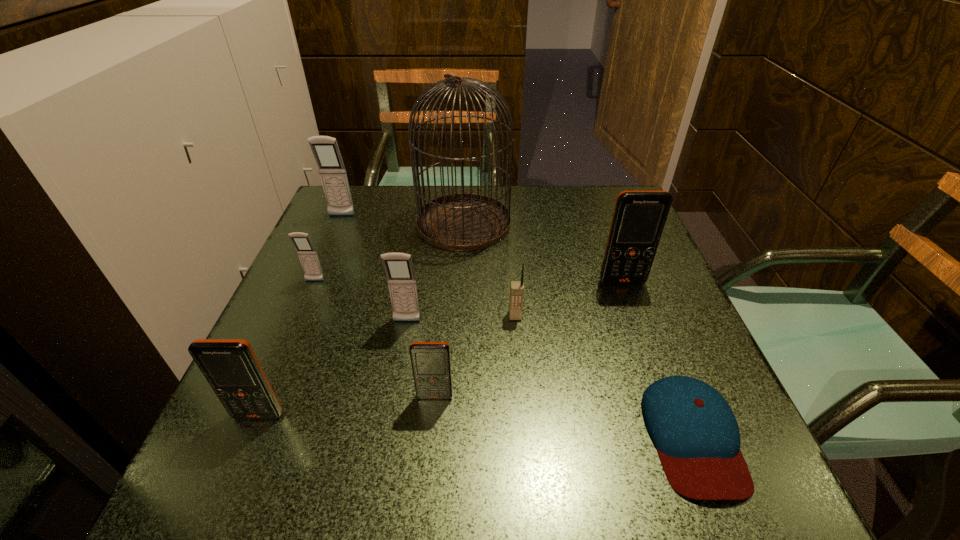
Locate an element on the screen. The height and width of the screenshot is (540, 960). the sixth farthest cellular telephone is located at coordinates (431, 364).

This screenshot has height=540, width=960. In order to click on the fifth cellular telephone from left to right in this screenshot , I will do `click(431, 364)`.

Identify the location of the second nearest gray cellular telephone. Image resolution: width=960 pixels, height=540 pixels. (307, 254).

Where is `baseball cap`? baseball cap is located at coordinates (697, 437).

Where is `vacant space located 0.170m on the right of the tallest object`? vacant space located 0.170m on the right of the tallest object is located at coordinates (577, 223).

The height and width of the screenshot is (540, 960). I want to click on vacant space located 0.270m on the front-facing side of the biggest gray cellular telephone, so click(x=310, y=289).

The image size is (960, 540). Find the location of `free space located 0.200m on the screen of the biggest orange cellular telephone`. free space located 0.200m on the screen of the biggest orange cellular telephone is located at coordinates (651, 360).

Identify the location of free location located 0.180m on the front-facing side of the fourth cellular telephone from left to right. (393, 407).

Image resolution: width=960 pixels, height=540 pixels. What are the coordinates of `blank space located 0.070m on the screen of the nearest orange cellular telephone` in the screenshot? It's located at coord(238,463).

Identify the location of vacant space located 0.290m on the front of the sixth cellular telephone from left to right, where the keypad is located. (527, 463).